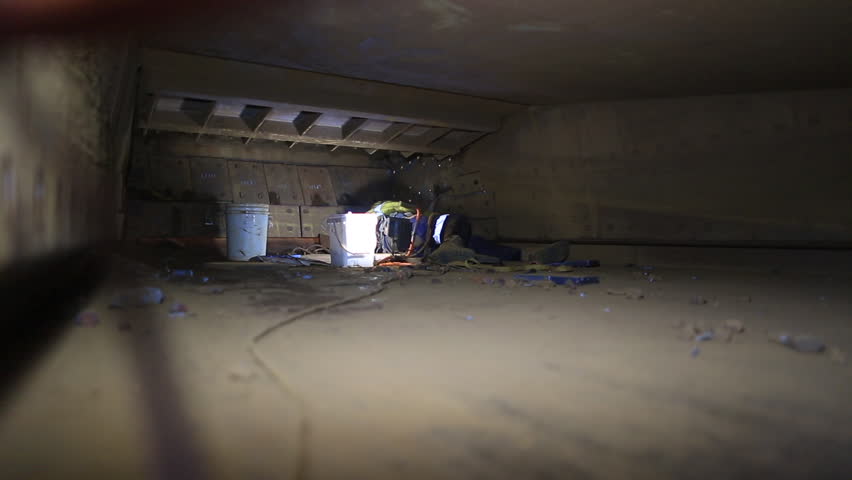
The image size is (852, 480). Identify the location of extension cord. (410, 238), (395, 265), (269, 330).